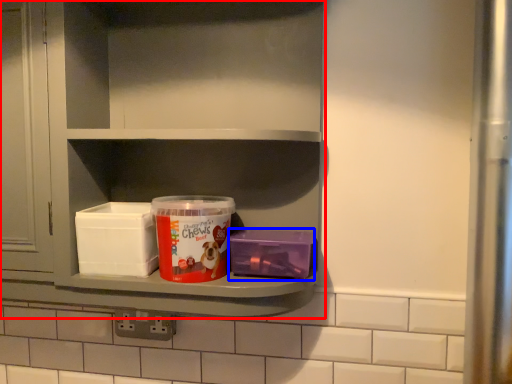
Question: Which point is closer to the camera, shelf (highlighted by a red box) or box (highlighted by a blue box)?

Choices:
 (A) shelf
 (B) box

Answer: (A)